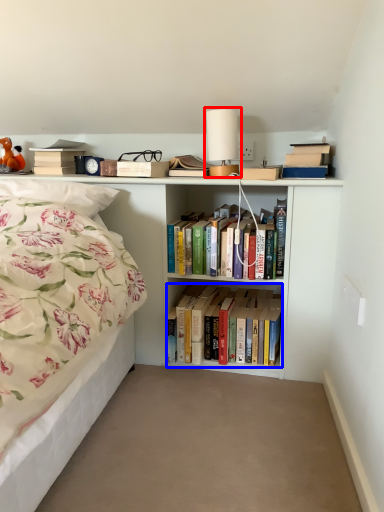
Question: Which object appears farthest to the camera in this image, table lamp (highlighted by a red box) or book (highlighted by a blue box)?

Choices:
 (A) table lamp
 (B) book

Answer: (B)